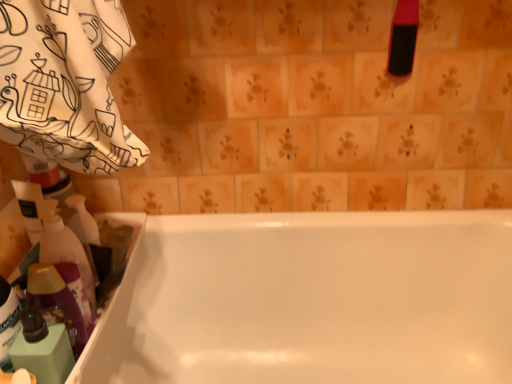
Find the location of a particular element. This screenshot has width=512, height=384. translucent plastic bottle at left, the second cleaning product in the left-to-right sequence is located at coordinates (65, 251).

Describe the element at coordinates (403, 39) in the screenshot. This screenshot has width=512, height=384. I see `pink rubber brush at upper right, which is the third cleaning product in left-to-right order` at that location.

This screenshot has height=384, width=512. What do you see at coordinates (311, 300) in the screenshot?
I see `white glossy bathtub at center` at bounding box center [311, 300].

Locate an element on the screen. The width and height of the screenshot is (512, 384). translucent plastic bottle at left, marked as the second cleaning product in a right-to-left arrangement is located at coordinates (65, 251).

Identify the location of cleaning product that is the 1st object to the left of the white glossy bathtub at center, starting at the anchor. The width and height of the screenshot is (512, 384). (65, 251).

Between translucent plastic bottle at left, which appears as the second cleaning product when ordered from the bottom, and white glossy bathtub at center, which one is positioned behind?

translucent plastic bottle at left, which appears as the second cleaning product when ordered from the bottom, is behind.

Is translucent plastic bottle at left, marked as the second cleaning product in a right-to-left arrangement, oriented towards white glossy bathtub at center?

No, translucent plastic bottle at left, marked as the second cleaning product in a right-to-left arrangement, does not turn towards white glossy bathtub at center.

From a real-world perspective, relative to white glossy bathtub at center, is translucent plastic bottle at left, the second cleaning product in the left-to-right sequence, vertically above or below?

translucent plastic bottle at left, the second cleaning product in the left-to-right sequence, is above white glossy bathtub at center.

Is translucent plastic bottle at left, the second cleaning product positioned from the top, looking in the opposite direction of pink rubber brush at upper right, which appears as the 1th cleaning product when viewed from the right?

translucent plastic bottle at left, the second cleaning product positioned from the top, does not have its back to pink rubber brush at upper right, which appears as the 1th cleaning product when viewed from the right.

Does point (92, 277) appear closer or farther from the camera than point (411, 68)?

Point (92, 277) appears to be closer to the viewer than point (411, 68).

Measure the distance between translucent plastic bottle at left, marked as the second cleaning product in a right-to-left arrangement, and pink rubber brush at upper right, which appears as the 1th cleaning product when viewed from the right.

translucent plastic bottle at left, marked as the second cleaning product in a right-to-left arrangement, is 31.18 inches away from pink rubber brush at upper right, which appears as the 1th cleaning product when viewed from the right.

From a real-world perspective, which object stands above the other?

pink rubber brush at upper right, acting as the 3th cleaning product starting from the bottom.

Considering the points (83, 357) and (396, 46), which point is behind, point (83, 357) or point (396, 46)?

The point (396, 46) is behind.

Considering the relative sizes of white glossy bathtub at center and pink rubber brush at upper right, which appears as the 1th cleaning product when viewed from the right, in the image provided, is white glossy bathtub at center smaller than pink rubber brush at upper right, which appears as the 1th cleaning product when viewed from the right,?

No, white glossy bathtub at center is not smaller than pink rubber brush at upper right, which appears as the 1th cleaning product when viewed from the right.

Consider the image. Which of these two, white glossy bathtub at center or pink rubber brush at upper right, which is the third cleaning product in left-to-right order, is thinner?

With smaller width is pink rubber brush at upper right, which is the third cleaning product in left-to-right order.

Is white glossy bathtub at center to the left or to the right of pink rubber brush at upper right, acting as the 3th cleaning product starting from the bottom, in the image?

white glossy bathtub at center is to the left of pink rubber brush at upper right, acting as the 3th cleaning product starting from the bottom.

Considering the sizes of white glossy bathtub at center and translucent plastic bottle at left, marked as the second cleaning product in a right-to-left arrangement, in the image, is white glossy bathtub at center bigger or smaller than translucent plastic bottle at left, marked as the second cleaning product in a right-to-left arrangement,?

white glossy bathtub at center is bigger than translucent plastic bottle at left, marked as the second cleaning product in a right-to-left arrangement.

Between white glossy bathtub at center and translucent plastic bottle at left, the second cleaning product positioned from the top, which one is positioned behind?

translucent plastic bottle at left, the second cleaning product positioned from the top, is more distant.

Between white glossy bathtub at center and translucent plastic bottle at left, which appears as the second cleaning product when ordered from the bottom, which one appears on the right side from the viewer's perspective?

white glossy bathtub at center is more to the right.

Can you tell me how much translucent plastic bottle at lower left, arranged as the first cleaning product when viewed from the left, and pink rubber brush at upper right, which appears as the 1th cleaning product when viewed from the top, differ in facing direction?

The facing directions of translucent plastic bottle at lower left, arranged as the first cleaning product when viewed from the left, and pink rubber brush at upper right, which appears as the 1th cleaning product when viewed from the top, are 86 degrees apart.

Consider the image. Who is smaller, translucent plastic bottle at lower left, arranged as the first cleaning product when viewed from the left, or pink rubber brush at upper right, acting as the 3th cleaning product starting from the bottom?

Smaller between the two is pink rubber brush at upper right, acting as the 3th cleaning product starting from the bottom.

From the image's perspective, is translucent plastic bottle at lower left, which is the 1th cleaning product in bottom-to-top order, positioned above or below pink rubber brush at upper right, which appears as the 1th cleaning product when viewed from the top?

translucent plastic bottle at lower left, which is the 1th cleaning product in bottom-to-top order, is below pink rubber brush at upper right, which appears as the 1th cleaning product when viewed from the top.

Considering their positions, is translucent plastic bottle at lower left, arranged as the first cleaning product when viewed from the left, located in front of or behind pink rubber brush at upper right, acting as the 3th cleaning product starting from the bottom?

Visually, translucent plastic bottle at lower left, arranged as the first cleaning product when viewed from the left, is located in front of pink rubber brush at upper right, acting as the 3th cleaning product starting from the bottom.

Looking at the image, does translucent plastic bottle at lower left, which is the 1th cleaning product in bottom-to-top order, seem bigger or smaller compared to translucent plastic bottle at left, which appears as the second cleaning product when ordered from the bottom?

In the image, translucent plastic bottle at lower left, which is the 1th cleaning product in bottom-to-top order, appears to be smaller than translucent plastic bottle at left, which appears as the second cleaning product when ordered from the bottom.

Is translucent plastic bottle at left, the second cleaning product positioned from the top, a part of translucent plastic bottle at lower left, placed as the 3th cleaning product when sorted from right to left?

Definitely not — translucent plastic bottle at left, the second cleaning product positioned from the top, is not inside translucent plastic bottle at lower left, placed as the 3th cleaning product when sorted from right to left.

From a real-world perspective, does translucent plastic bottle at lower left, which is the 1th cleaning product in bottom-to-top order, sit lower than translucent plastic bottle at left, which appears as the second cleaning product when ordered from the bottom?

Yes.

Does white glossy bathtub at center have a greater height compared to translucent plastic bottle at lower left, placed as the third cleaning product when sorted from top to bottom?

Yes, white glossy bathtub at center is taller than translucent plastic bottle at lower left, placed as the third cleaning product when sorted from top to bottom.

Who is smaller, white glossy bathtub at center or translucent plastic bottle at lower left, placed as the 3th cleaning product when sorted from right to left?

translucent plastic bottle at lower left, placed as the 3th cleaning product when sorted from right to left.

Which is correct: white glossy bathtub at center is inside translucent plastic bottle at lower left, placed as the third cleaning product when sorted from top to bottom, or outside of it?

white glossy bathtub at center is spatially situated outside translucent plastic bottle at lower left, placed as the third cleaning product when sorted from top to bottom.

The image size is (512, 384). What are the coordinates of `bathtub that appears below the translucent plastic bottle at left, which appears as the second cleaning product when ordered from the bottom (from a real-world perspective)` in the screenshot? It's located at 311,300.

The image size is (512, 384). In order to click on the 1st cleaning product in front of the pink rubber brush at upper right, which is the third cleaning product in left-to-right order, starting your count from the anchor in this screenshot , I will do `click(65, 251)`.

Looking at the image, which one is located further to white glossy bathtub at center, translucent plastic bottle at left, the second cleaning product in the left-to-right sequence, or pink rubber brush at upper right, which is the third cleaning product in left-to-right order?

pink rubber brush at upper right, which is the third cleaning product in left-to-right order, is further to white glossy bathtub at center.

When comparing their distances from pink rubber brush at upper right, which appears as the 1th cleaning product when viewed from the right, does translucent plastic bottle at lower left, arranged as the first cleaning product when viewed from the left, or white glossy bathtub at center seem further?

translucent plastic bottle at lower left, arranged as the first cleaning product when viewed from the left, is positioned further to the anchor pink rubber brush at upper right, which appears as the 1th cleaning product when viewed from the right.

From the picture: Looking at the image, which one is located closer to white glossy bathtub at center, translucent plastic bottle at lower left, placed as the third cleaning product when sorted from top to bottom, or pink rubber brush at upper right, which appears as the 1th cleaning product when viewed from the top?

translucent plastic bottle at lower left, placed as the third cleaning product when sorted from top to bottom, is closer to white glossy bathtub at center.

Estimate the real-world distances between objects in this image. Which object is further from translucent plastic bottle at lower left, placed as the 3th cleaning product when sorted from right to left, pink rubber brush at upper right, which is the third cleaning product in left-to-right order, or translucent plastic bottle at left, marked as the second cleaning product in a right-to-left arrangement?

pink rubber brush at upper right, which is the third cleaning product in left-to-right order.

Which object lies nearer to the anchor point translucent plastic bottle at lower left, placed as the third cleaning product when sorted from top to bottom, white glossy bathtub at center or pink rubber brush at upper right, which appears as the 1th cleaning product when viewed from the right?

Among the two, white glossy bathtub at center is located nearer to translucent plastic bottle at lower left, placed as the third cleaning product when sorted from top to bottom.

Estimate the real-world distances between objects in this image. Which object is closer to white glossy bathtub at center, translucent plastic bottle at lower left, placed as the 3th cleaning product when sorted from right to left, or translucent plastic bottle at left, marked as the second cleaning product in a right-to-left arrangement?

Among the two, translucent plastic bottle at left, marked as the second cleaning product in a right-to-left arrangement, is located nearer to white glossy bathtub at center.

Based on the photo, based on their spatial positions, is pink rubber brush at upper right, which is the third cleaning product in left-to-right order, or white glossy bathtub at center further from translucent plastic bottle at lower left, which is the 1th cleaning product in bottom-to-top order?

The object further to translucent plastic bottle at lower left, which is the 1th cleaning product in bottom-to-top order, is pink rubber brush at upper right, which is the third cleaning product in left-to-right order.

From the image, which object appears to be nearer to white glossy bathtub at center, pink rubber brush at upper right, which is the third cleaning product in left-to-right order, or translucent plastic bottle at left, the second cleaning product positioned from the top?

translucent plastic bottle at left, the second cleaning product positioned from the top, is positioned closer to the anchor white glossy bathtub at center.

Find the location of a particular element. The height and width of the screenshot is (384, 512). cleaning product between translucent plastic bottle at lower left, which is the 1th cleaning product in bottom-to-top order, and white glossy bathtub at center is located at coordinates (65, 251).

Image resolution: width=512 pixels, height=384 pixels. What are the coordinates of `cleaning product situated between translucent plastic bottle at lower left, arranged as the first cleaning product when viewed from the left, and pink rubber brush at upper right, which appears as the 1th cleaning product when viewed from the top, from left to right` in the screenshot? It's located at (65, 251).